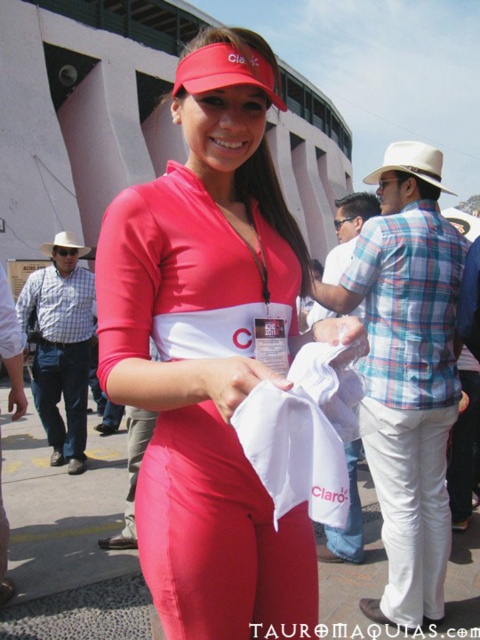
Question: Which point is farther to the camera?

Choices:
 (A) (79, 248)
 (B) (412, 172)
 (C) (122, 330)

Answer: (A)

Question: Which of these objects is positioned farthest from the beige straw hat at upper right?

Choices:
 (A) white felt baseball hat at left
 (B) matte red uniform at center

Answer: (A)

Question: Can you confirm if matte red uniform at center is bigger than white felt baseball hat at left?

Choices:
 (A) no
 (B) yes

Answer: (A)

Question: Is beige straw hat at upper right thinner than white felt baseball hat at left?

Choices:
 (A) no
 (B) yes

Answer: (A)

Question: From the image, what is the correct spatial relationship of matte red uniform at center in relation to white felt baseball hat at left?

Choices:
 (A) left
 (B) right

Answer: (B)

Question: Considering the real-world distances, which object is farthest from the beige straw hat at upper right?

Choices:
 (A) white felt baseball hat at left
 (B) matte red uniform at center

Answer: (A)